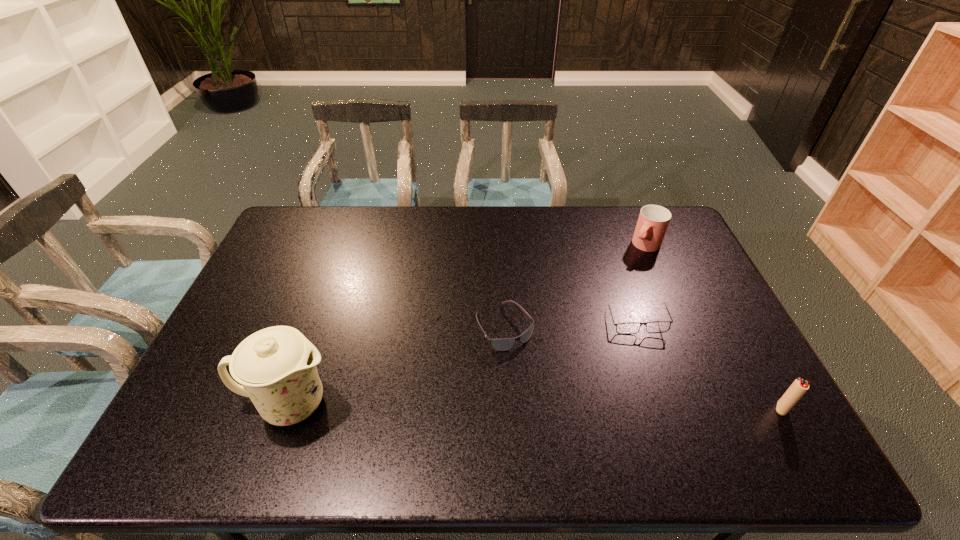
Locate an element on the screen. vacant space located 0.230m with the lenses facing outward on the spectacles is located at coordinates (601, 396).

At what (x,y) coordinates should I click in order to perform the action: click on vacant space located 0.190m on the side of the farthest object with the handle. Please return your answer as a coordinate pair (x, y). Image resolution: width=960 pixels, height=540 pixels. Looking at the image, I should click on (612, 284).

You are a GUI agent. You are given a task and a screenshot of the screen. Output one action in this format:
    pyautogui.click(x=<x>, y=<y>)
    Task: Click on the free space located 0.100m on the side of the farthest object with the handle
    
    Given the screenshot: What is the action you would take?
    pyautogui.click(x=625, y=269)

Where is `free space located 0.140m on the side of the farthest object with the handle`? This screenshot has width=960, height=540. free space located 0.140m on the side of the farthest object with the handle is located at coordinates (620, 275).

You are a GUI agent. You are given a task and a screenshot of the screen. Output one action in this format:
    pyautogui.click(x=<x>, y=<y>)
    Task: Click on the vacant space located 0.220m on the lenses of the sunglasses
    
    Given the screenshot: What is the action you would take?
    pyautogui.click(x=567, y=414)

Find the location of a particular element. This screenshot has width=960, height=540. vacant space situated on the lenses of the sunglasses is located at coordinates (548, 388).

Identify the location of vacant space located 0.150m on the lenses of the sunglasses. (551, 392).

This screenshot has height=540, width=960. Identify the location of object that is at the far edge. (653, 220).

At what (x,y) coordinates should I click in order to perform the action: click on chinaware that is at the near edge. Please return your answer as a coordinate pair (x, y). This screenshot has width=960, height=540. Looking at the image, I should click on (276, 366).

Where is `igniter located in the near edge section of the desktop`? The image size is (960, 540). igniter located in the near edge section of the desktop is located at coordinates (798, 388).